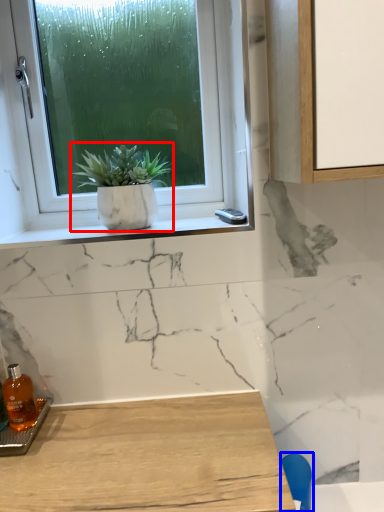
Question: Which object is further to the camera taking this photo, houseplant (highlighted by a red box) or chair (highlighted by a blue box)?

Choices:
 (A) houseplant
 (B) chair

Answer: (A)